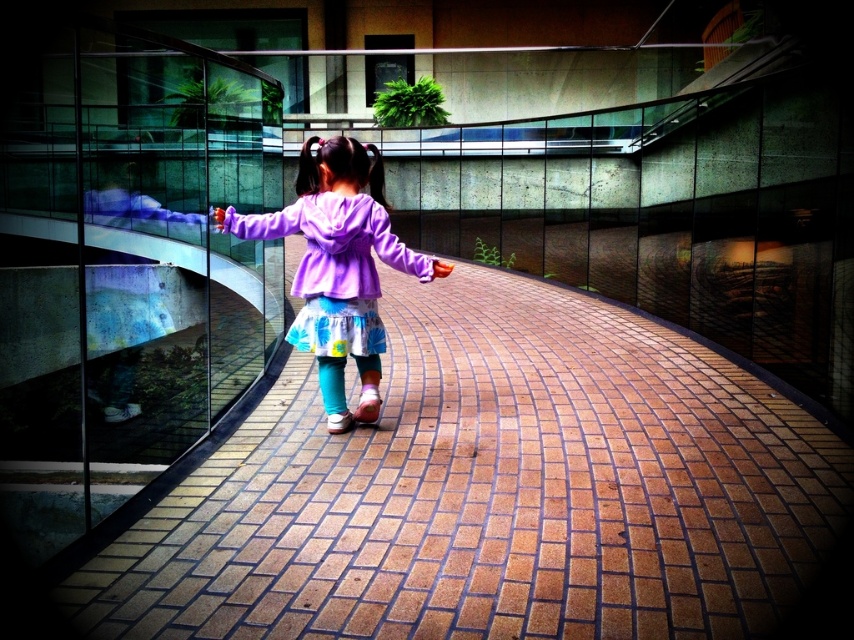
Question: Which object is farther from the camera taking this photo?

Choices:
 (A) brick at center
 (B) purple fleece jacket at center

Answer: (B)

Question: Does brick at center lie in front of purple fleece jacket at center?

Choices:
 (A) no
 (B) yes

Answer: (B)

Question: Which point is farther from the camera taking this photo?

Choices:
 (A) (309, 259)
 (B) (464, 332)

Answer: (B)

Question: In this image, where is brick at center located relative to purple fleece jacket at center?

Choices:
 (A) above
 (B) below

Answer: (B)

Question: Is brick at center positioned in front of purple fleece jacket at center?

Choices:
 (A) no
 (B) yes

Answer: (B)